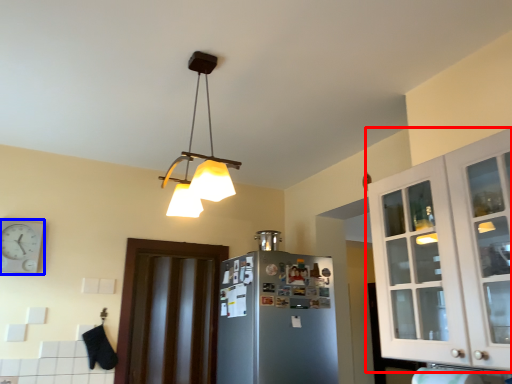
Question: Which object appears farthest to the camera in this image, cabinetry (highlighted by a red box) or clock (highlighted by a blue box)?

Choices:
 (A) cabinetry
 (B) clock

Answer: (B)